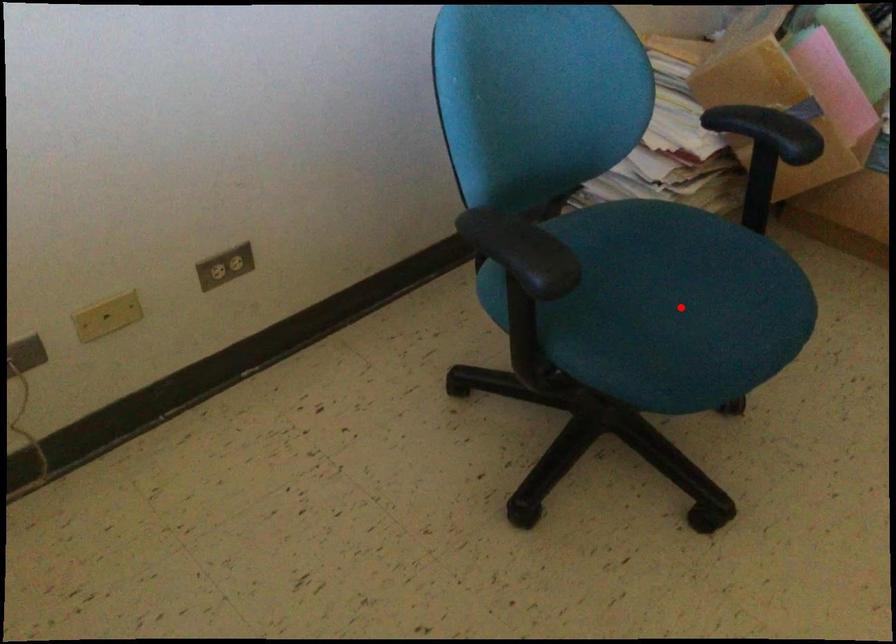
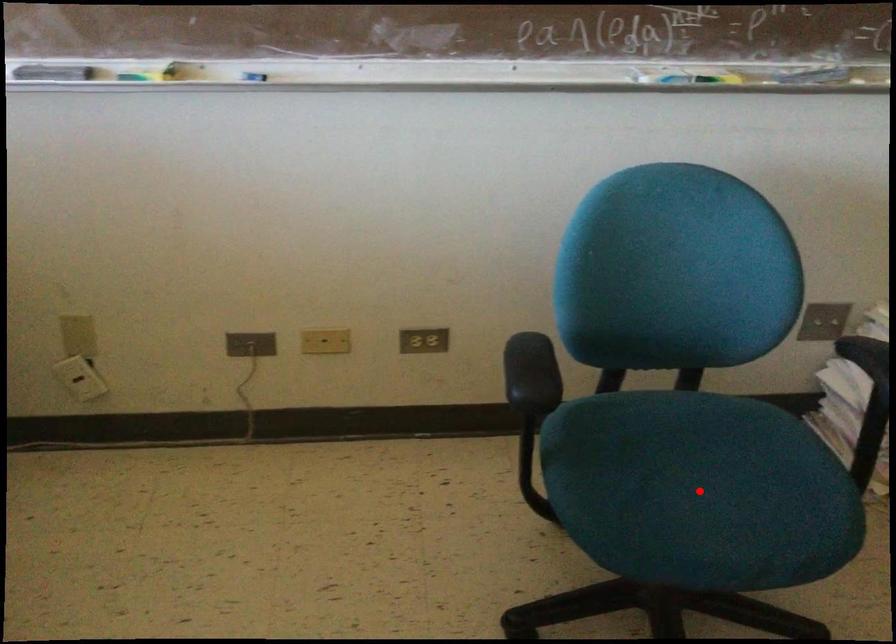
I am providing you with two images of the same scene from different viewpoints. A red point is marked on the first image and another point is marked on the second image. Do the highlighted points in image1 and image2 indicate the same real-world spot?

Yes